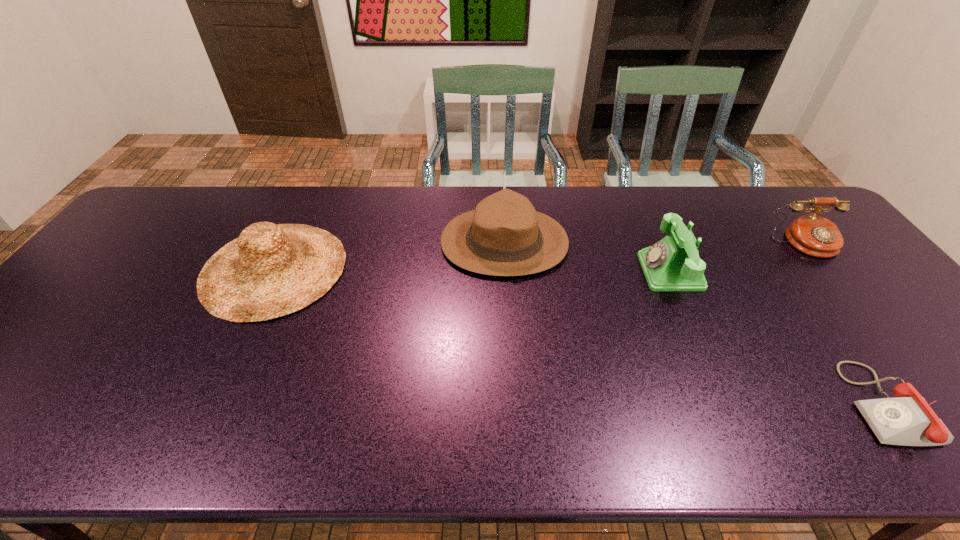
Where is `free spot at the left edge of the desktop`? This screenshot has width=960, height=540. free spot at the left edge of the desktop is located at coordinates (58, 346).

In the image, there is a desktop. In order to click on free space at the right edge in this screenshot , I will do `click(833, 266)`.

The width and height of the screenshot is (960, 540). I want to click on unoccupied position between the tallest object and the sunhat, so click(390, 255).

Locate an element on the screen. Image resolution: width=960 pixels, height=540 pixels. free space between the second object from left to right and the second tallest telephone is located at coordinates (655, 242).

Locate an element on the screen. free space between the second object from left to right and the third object from left to right is located at coordinates (588, 257).

Locate an element on the screen. The width and height of the screenshot is (960, 540). free area in between the third object from right to left and the fedora is located at coordinates [x=588, y=257].

Find the location of `free space between the second shortest telephone and the leftmost telephone`. free space between the second shortest telephone and the leftmost telephone is located at coordinates (737, 257).

Locate which object is the closest to the leftmost object. Please provide its 2D coordinates. Your answer should be formatted as a tuple, i.e. [(x, y)], where the tuple contains the x and y coordinates of a point satisfying the conditions above.

[(504, 236)]

Where is `object that is the third closest one to the sunhat`? This screenshot has height=540, width=960. object that is the third closest one to the sunhat is located at coordinates (907, 419).

What are the coordinates of `the second closest telephone to the leftmost object` in the screenshot? It's located at (907, 419).